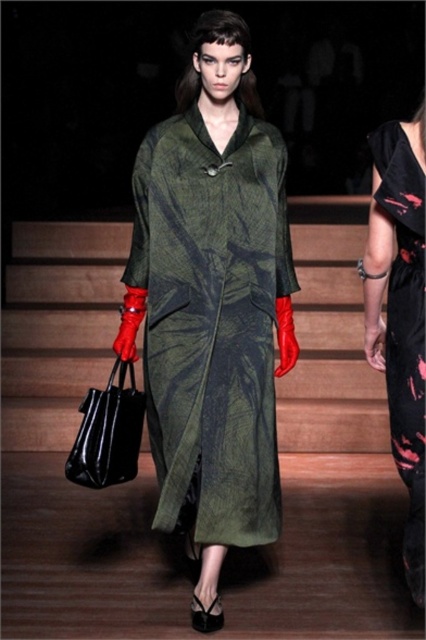
Question: Does matte green dress at center have a greater width compared to black leather bag at lower left?

Choices:
 (A) yes
 (B) no

Answer: (A)

Question: Does matte green dress at center appear over black leather bag at lower left?

Choices:
 (A) yes
 (B) no

Answer: (A)

Question: Based on their relative distances, which object is nearer to the ripped black dress at right?

Choices:
 (A) black leather bag at lower left
 (B) matte green dress at center

Answer: (B)

Question: Which object appears closest to the camera in this image?

Choices:
 (A) ripped black dress at right
 (B) matte green dress at center

Answer: (A)

Question: Which object appears closest to the camera in this image?

Choices:
 (A) black leather bag at lower left
 (B) ripped black dress at right

Answer: (B)

Question: Is matte green dress at center thinner than black leather bag at lower left?

Choices:
 (A) no
 (B) yes

Answer: (A)